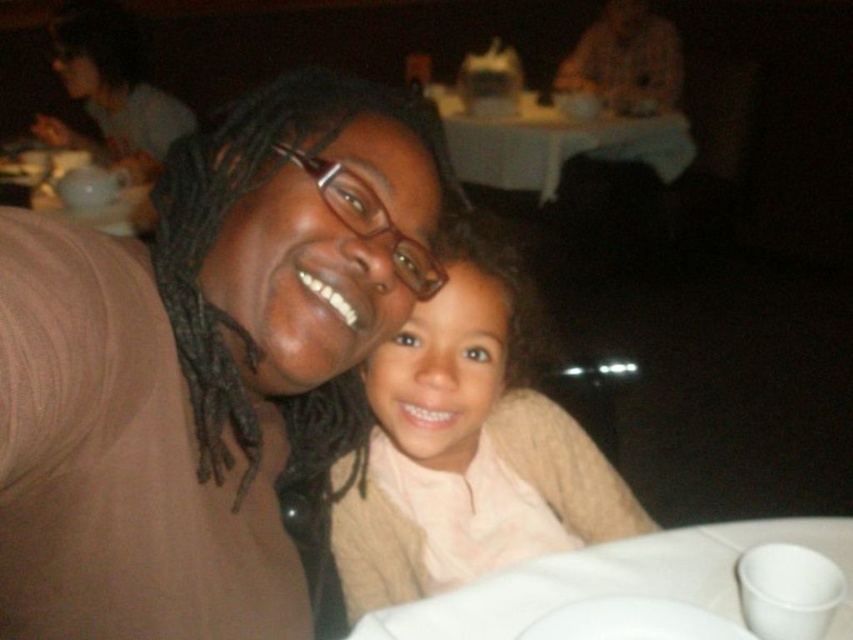
Does white paper plate at lower center have a lesser height compared to white matte plate at lower center?

Incorrect, white paper plate at lower center's height does not fall short of white matte plate at lower center's.

Based on the photo, between white paper plate at lower center and white matte plate at lower center, which one is positioned lower?

Positioned lower is white paper plate at lower center.

Image resolution: width=853 pixels, height=640 pixels. I want to click on white paper plate at lower center, so click(x=616, y=580).

Between matte brown sweater at center and white paper plate at lower center, which one is positioned lower?

white paper plate at lower center is below.

Does point (260, 368) lie behind point (535, 609)?

No, (260, 368) is closer to viewer.

What are the coordinates of `matte brown sweater at center` in the screenshot? It's located at (198, 371).

Does smooth beige sweater at center appear on the right side of white matte plate at lower center?

No, smooth beige sweater at center is not to the right of white matte plate at lower center.

Is point (477, 516) behind point (572, 625)?

Yes, point (477, 516) is behind point (572, 625).

Is point (463, 428) farther from viewer compared to point (660, 605)?

Yes, it is.

The width and height of the screenshot is (853, 640). Find the location of `smooth beige sweater at center`. smooth beige sweater at center is located at coordinates (467, 449).